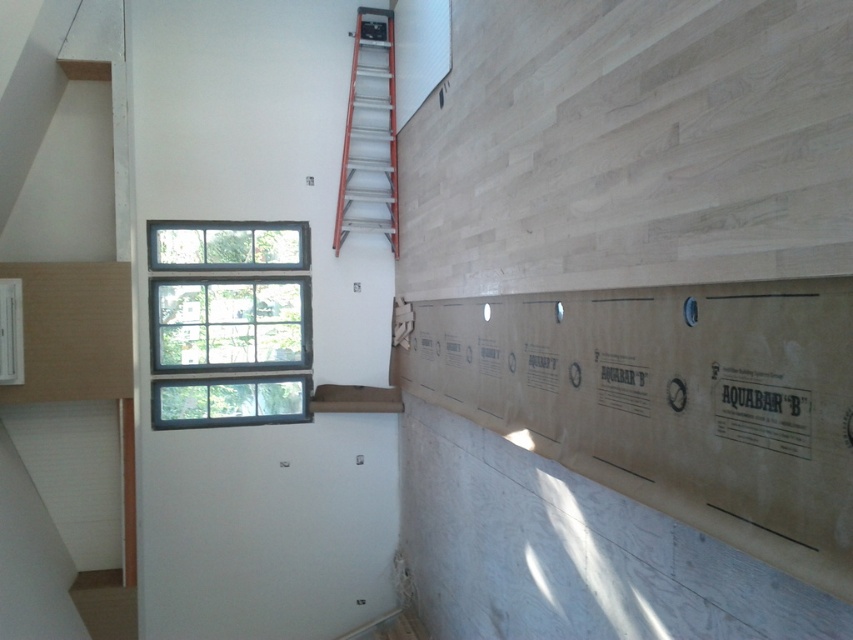
You are a painter standing at the base of the orange fiberglass ladder at upper center, holding a paintbrush. You want to reach the clear glass window at upper left to clean it. Given that your arm can extend 1.2 meters, can you reach the window from your current position without moving the ladder?

The distance between the clear glass window at upper left and the orange fiberglass ladder at upper center is 1.29 meters. Since your arm can only extend 1.2 meters, you cannot reach the window from your current position without moving the ladder.

You are an inspector checking the vapor barrier installation. The vapor barrier labeled AQUABAR B must be installed below all windows to prevent moisture. Based on the coordinates provided, is the clear glass window at upper left positioned above the vapor barrier AQUABAR B?

The clear glass window at upper left is located at point (229, 323). Since the vapor barrier must be installed below windows, the window is positioned above the vapor barrier AQUABAR B, so the installation meets the requirement.

You are a contractor working in the room and need to determine if the orange fiberglass ladder at upper center can fit through the clear glass window at upper left. Based on their sizes, can the ladder fit through the window?

The clear glass window at upper left is larger in size than orange fiberglass ladder at upper center, so the ladder can fit through the window.